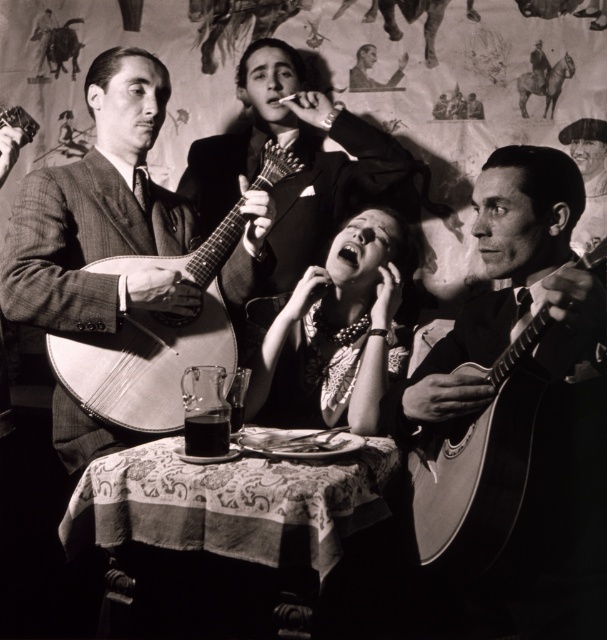
Between matte black necklace at center and shiny wood mandolin at right, which one is positioned higher?

matte black necklace at center is higher up.

Does matte black necklace at center have a greater width compared to shiny wood mandolin at right?

Yes.

Does point (262, 342) come in front of point (484, 554)?

No, it is behind (484, 554).

Identify the location of matte black necklace at center. (333, 332).

Between matte black necklace at center and matte wooden guitar at left, which one has more height?

Standing taller between the two is matte wooden guitar at left.

This screenshot has width=607, height=640. What do you see at coordinates (333, 332) in the screenshot?
I see `matte black necklace at center` at bounding box center [333, 332].

Find the location of `matte black necklace at center`. matte black necklace at center is located at coordinates (333, 332).

Can you confirm if shiny wood mandolin at right is bigger than matte wooden guitar at left?

No.

Is point (463, 467) more distant than point (186, 337)?

No.

The height and width of the screenshot is (640, 607). In order to click on shiny wood mandolin at right in this screenshot , I will do `click(476, 464)`.